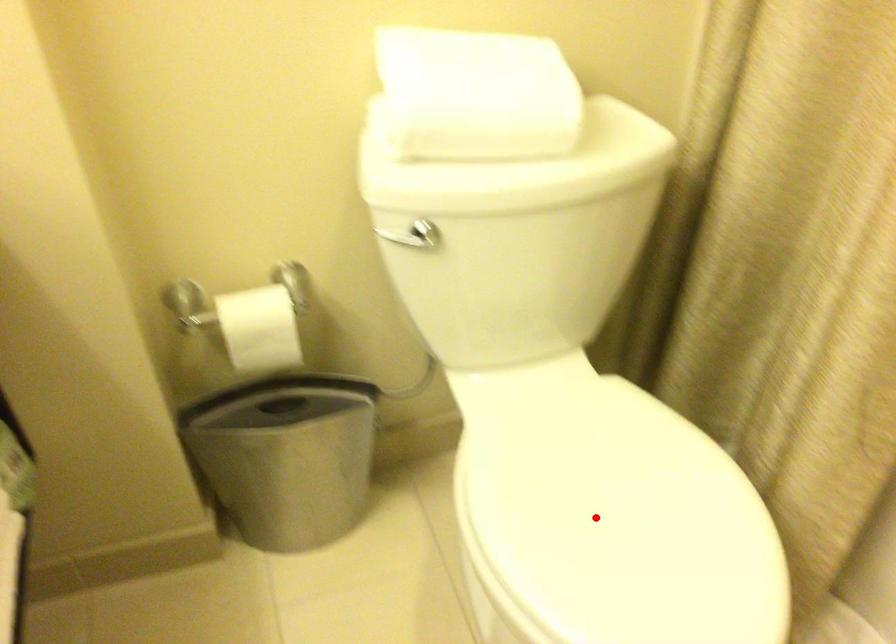
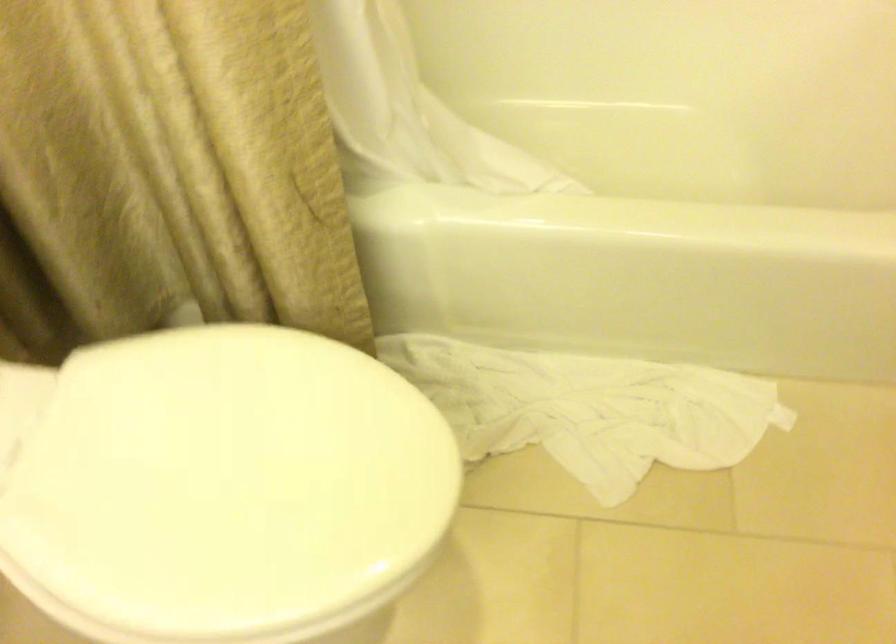
Question: I am providing you with two images of the same scene from different viewpoints. A red point is shown in image1. For the corresponding object point in image2, is it positioned nearer or farther from the camera?

Choices:
 (A) Nearer
 (B) Farther

Answer: (A)